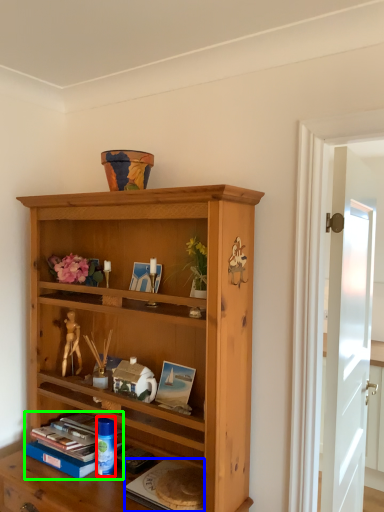
Question: Which object is the farthest from toy (highlighted by a red box)? Choose among these: paperback book (highlighted by a blue box) or book (highlighted by a green box).

Choices:
 (A) paperback book
 (B) book

Answer: (A)